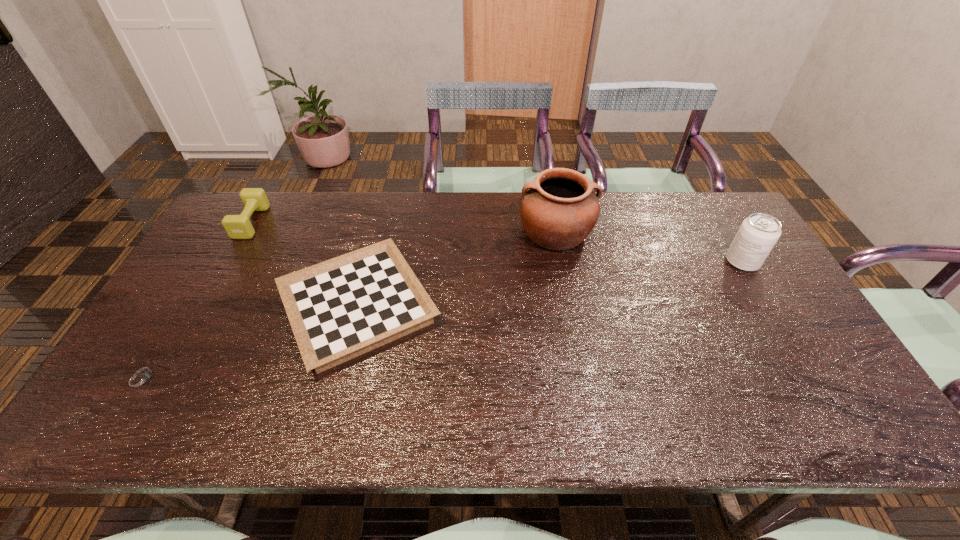
I want to click on free space located on the right of the dumbbell, so click(x=284, y=222).

This screenshot has height=540, width=960. I want to click on blank space located on the left of the checkerboard, so click(181, 307).

In order to click on free space located on the face of the watch in this screenshot , I will do (184, 377).

You are a GUI agent. You are given a task and a screenshot of the screen. Output one action in this format:
    pyautogui.click(x=<x>, y=<y>)
    Task: Click on the pottery that is positioned at the far edge
    This screenshot has width=960, height=540.
    Given the screenshot: What is the action you would take?
    pyautogui.click(x=559, y=209)

The height and width of the screenshot is (540, 960). What are the coordinates of `dumbbell present at the far edge` in the screenshot? It's located at (254, 199).

Locate an element on the screen. dumbbell situated at the left edge is located at coordinates (254, 199).

Where is `watch located in the left edge section of the desktop`? The image size is (960, 540). watch located in the left edge section of the desktop is located at coordinates (142, 377).

The width and height of the screenshot is (960, 540). I want to click on object located in the right edge section of the desktop, so click(x=758, y=233).

Identify the location of object located at the far left corner. The image size is (960, 540). (254, 199).

At what (x,y) coordinates should I click in order to perform the action: click on free space at the far edge of the desktop. Please return your answer as a coordinate pair (x, y). Image resolution: width=960 pixels, height=540 pixels. Looking at the image, I should click on (418, 222).